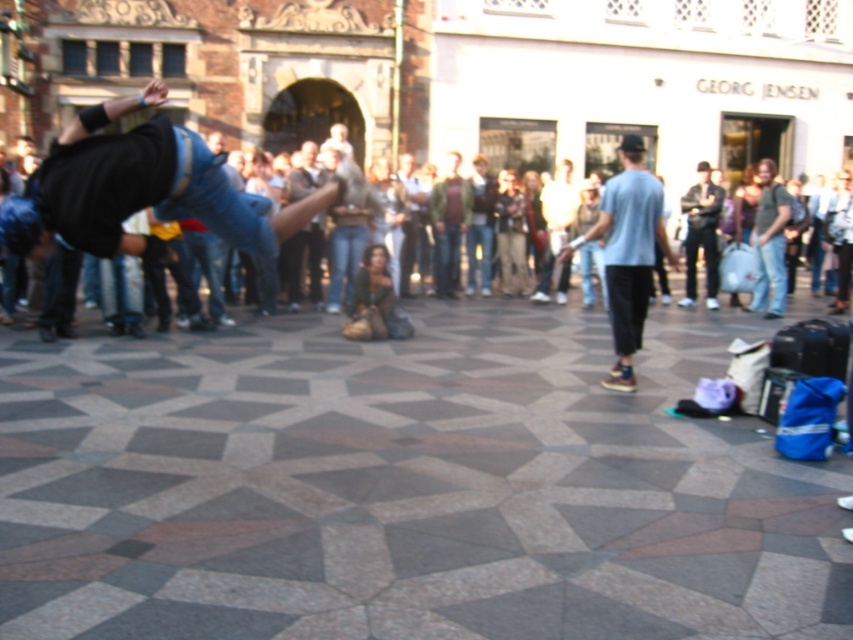
Question: Which of these objects is positioned farthest from the jeans at center?

Choices:
 (A) denim jeans at left
 (B) light blue t-shirt at center
 (C) dark blue jeans at center

Answer: (C)

Question: Which of the following is the closest to the observer?

Choices:
 (A) (706, 284)
 (B) (44, 172)

Answer: (B)

Question: Which point is farther to the camera?

Choices:
 (A) light blue t-shirt at center
 (B) jeans at center
 (C) denim jeans at left

Answer: (A)

Question: Does denim jeans at left have a lesser width compared to light blue t-shirt at center?

Choices:
 (A) yes
 (B) no

Answer: (B)

Question: Can you confirm if denim jeans at left is thinner than light blue t-shirt at center?

Choices:
 (A) no
 (B) yes

Answer: (A)

Question: From the image, what is the correct spatial relationship of jeans at center in relation to dark blue jeans at center?

Choices:
 (A) right
 (B) left

Answer: (B)